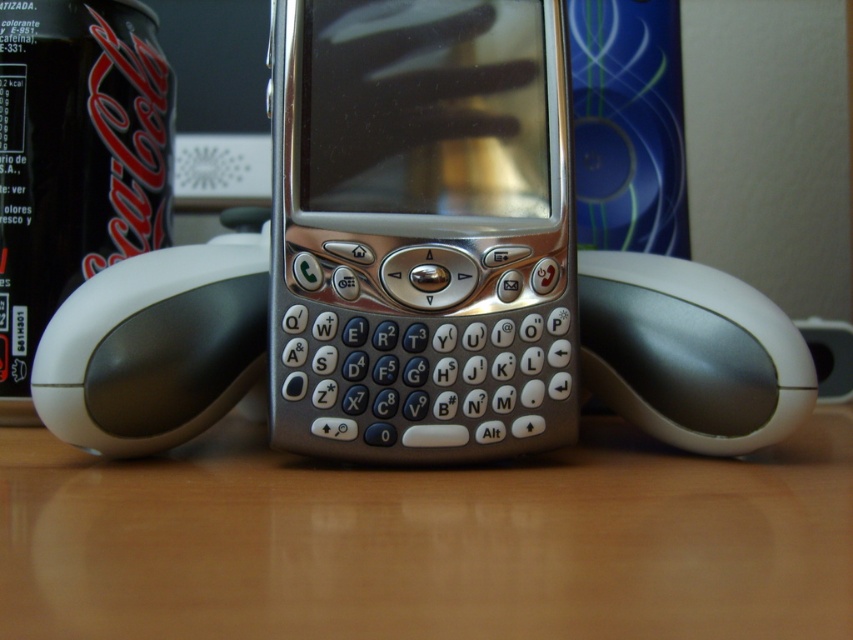
Question: Is wooden table at center further to the viewer compared to white glossy mouse at center?

Choices:
 (A) yes
 (B) no

Answer: (B)

Question: Which of the following is the closest to the observer?

Choices:
 (A) (83, 214)
 (B) (698, 289)
 (C) (553, 8)

Answer: (B)

Question: Considering the real-world distances, which object is farthest from the black matte can at left?

Choices:
 (A) silver metallic smartphone at center
 (B) wooden table at center

Answer: (B)

Question: Does wooden table at center have a smaller size compared to silver metallic smartphone at center?

Choices:
 (A) yes
 (B) no

Answer: (B)

Question: Considering the relative positions of black matte can at left and white glossy mouse at center in the image provided, where is black matte can at left located with respect to white glossy mouse at center?

Choices:
 (A) above
 (B) below

Answer: (A)

Question: Which point is farther to the camera?

Choices:
 (A) silver metallic smartphone at center
 (B) wooden table at center
 (C) black matte can at left

Answer: (C)